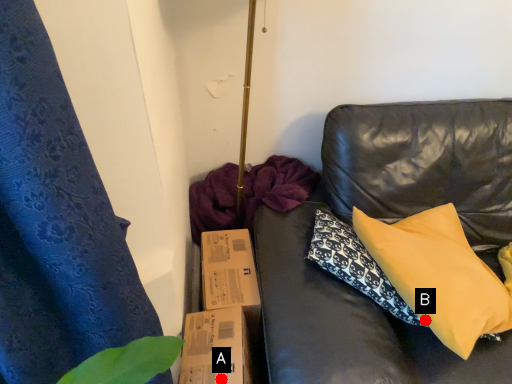
Question: Two points are circled on the image, labeled by A and B beside each circle. Which point is farther to the camera?

Choices:
 (A) A is further
 (B) B is further

Answer: (B)